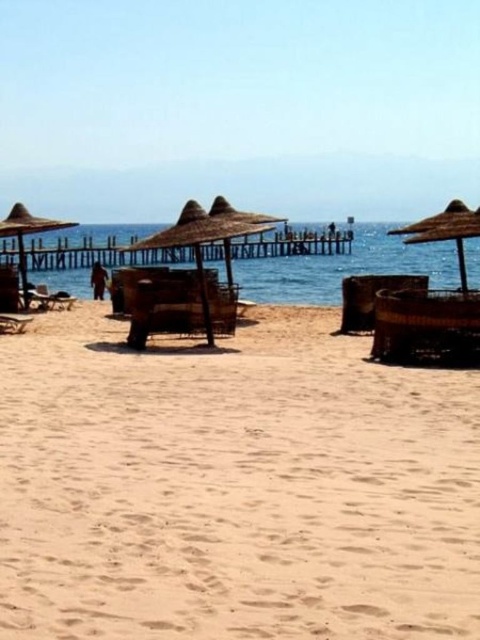
Between brown woven umbrella at center and straw umbrella at right, which one appears on the left side from the viewer's perspective?

From the viewer's perspective, brown woven umbrella at center appears more on the left side.

Between brown woven umbrella at center and straw umbrella at right, which one is positioned higher?

straw umbrella at right is higher up.

Does point (217, 282) come behind point (441, 216)?

No, it is not.

Where is `brown woven umbrella at center`? The image size is (480, 640). brown woven umbrella at center is located at coordinates (188, 276).

Does sandy beige at center have a larger size compared to blue water at center?

Incorrect, sandy beige at center is not larger than blue water at center.

Is sandy beige at center further to the viewer compared to blue water at center?

No.

Find the location of a particular element. The height and width of the screenshot is (640, 480). sandy beige at center is located at coordinates (233, 486).

Does brown woven umbrella at center have a greater width compared to straw umbrella at left?

Indeed, brown woven umbrella at center has a greater width compared to straw umbrella at left.

Is brown woven umbrella at center above straw umbrella at left?

No.

The height and width of the screenshot is (640, 480). Describe the element at coordinates (188, 276) in the screenshot. I see `brown woven umbrella at center` at that location.

You are a GUI agent. You are given a task and a screenshot of the screen. Output one action in this format:
    pyautogui.click(x=<x>, y=<y>)
    Task: Click on the brown woven umbrella at center
    
    Given the screenshot: What is the action you would take?
    pyautogui.click(x=188, y=276)